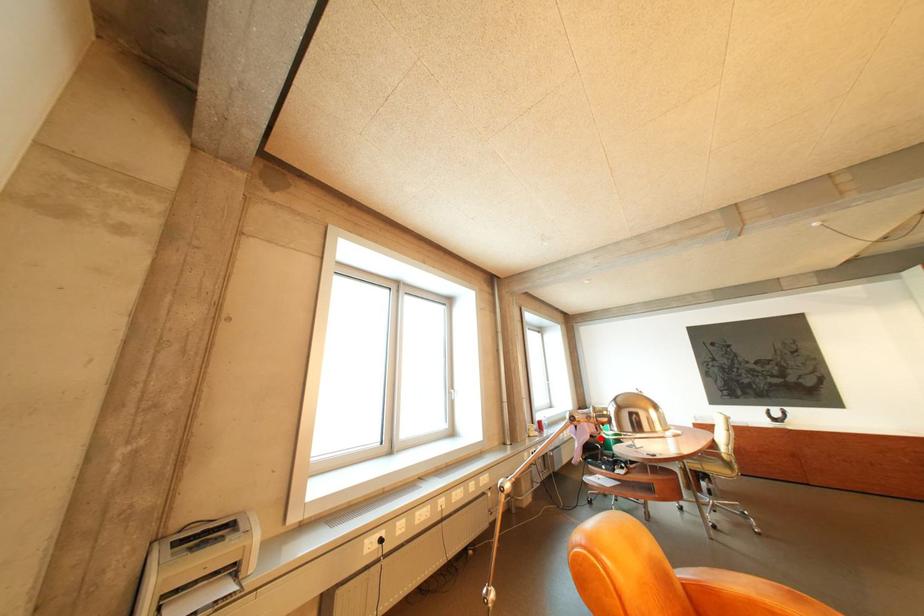
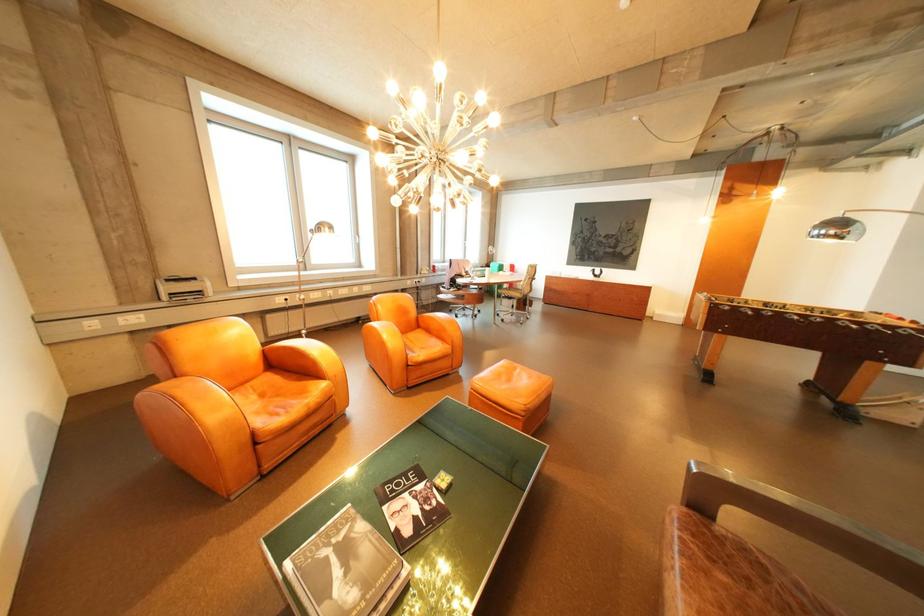
Question: I am providing you with two images of the same scene from different viewpoints. In image1, a red point is highlighted. Considering the same 3D point in image2, which of the following is correct?

Choices:
 (A) It is closer
 (B) It is farther

Answer: (A)